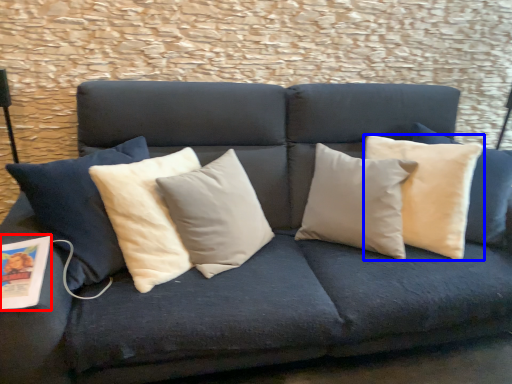
Question: Which object appears closest to the camera in this image, magazine (highlighted by a red box) or pillow (highlighted by a blue box)?

Choices:
 (A) magazine
 (B) pillow

Answer: (A)